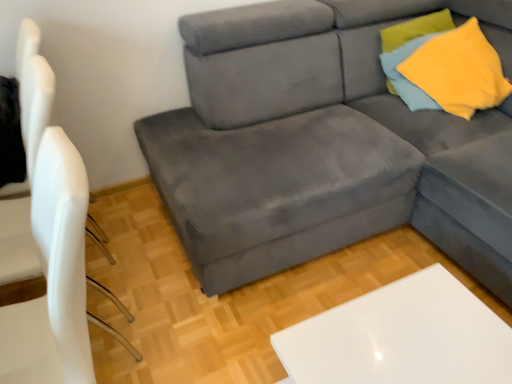
What are the coordinates of `blank space above white glossy table at lower right (from a real-world perspective)` in the screenshot? It's located at (403, 341).